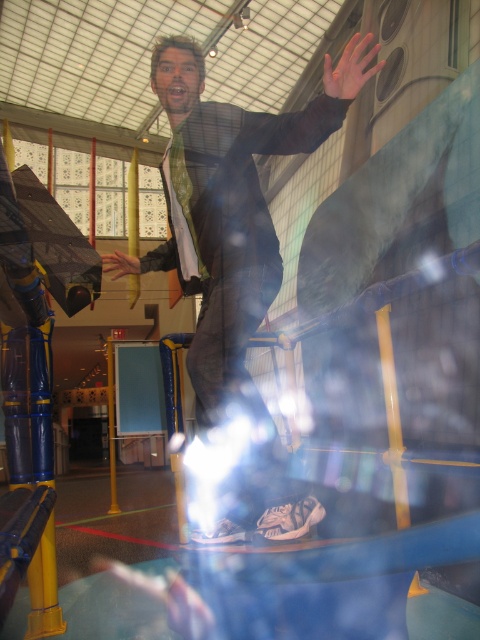
Is shiny black suit at center shorter than matte black hand at center?

Incorrect, shiny black suit at center's height does not fall short of matte black hand at center's.

The height and width of the screenshot is (640, 480). What do you see at coordinates (223, 216) in the screenshot? I see `shiny black suit at center` at bounding box center [223, 216].

Identify the location of shiny black suit at center. (223, 216).

Is orange matte hand at upper center smaller than matte black hand at center?

No.

Is orange matte hand at upper center thinner than matte black hand at center?

Incorrect, orange matte hand at upper center's width is not less than matte black hand at center's.

Which is in front, point (369, 76) or point (116, 259)?

Point (369, 76) is in front.

At what (x,y) coordinates should I click in order to perform the action: click on orange matte hand at upper center. Please return your answer as a coordinate pair (x, y). This screenshot has width=480, height=640. Looking at the image, I should click on (350, 67).

Can you confirm if shiny black suit at center is shorter than orange matte hand at upper center?

No.

Find the location of a particular element. The width and height of the screenshot is (480, 640). shiny black suit at center is located at coordinates (223, 216).

Locate an element on the screen. shiny black suit at center is located at coordinates (223, 216).

Where is `shiny black suit at center`? This screenshot has height=640, width=480. shiny black suit at center is located at coordinates (223, 216).